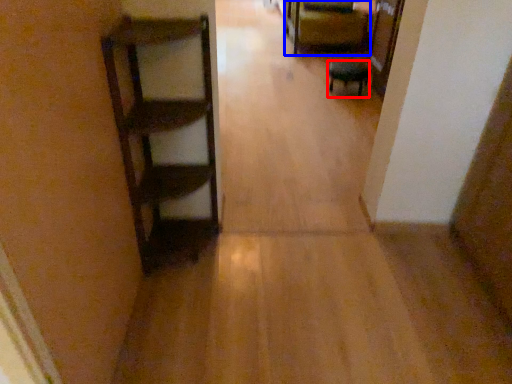
Question: Which object is further to the camera taking this photo, furniture (highlighted by a red box) or furniture (highlighted by a blue box)?

Choices:
 (A) furniture
 (B) furniture

Answer: (B)